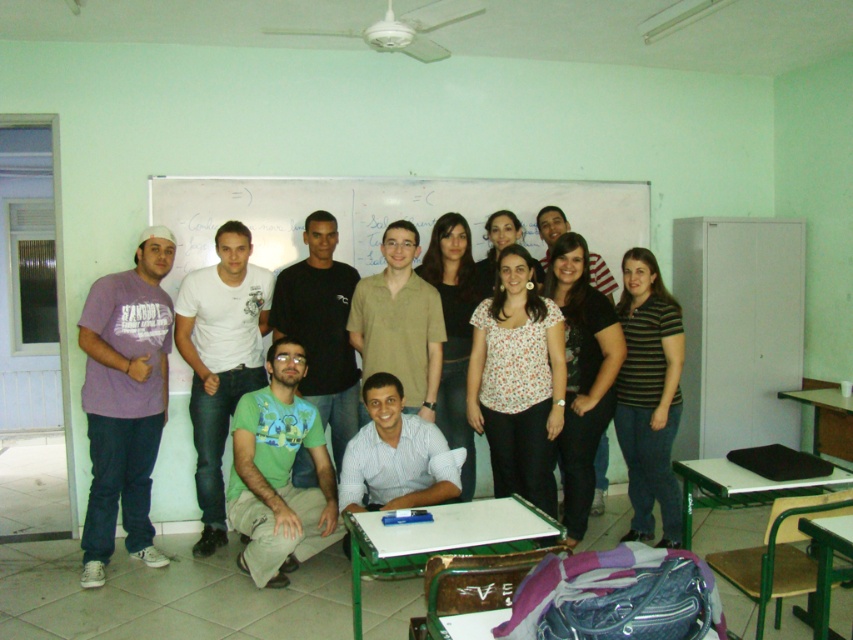
You are a photographer trying to adjust the composition of this group photo. You notice the striped cotton shirt at right and the white dotted shirt at center. Which of these two shirts is positioned lower in the image?

The striped cotton shirt at right is located below the white dotted shirt at center, so it is positioned lower in the image.

You are a photographer trying to adjust the framing of a group photo. You notice two shirts in the image, a striped cotton shirt at right and a white dotted shirt at center. Which shirt should you adjust to ensure both shirts are equally visible in the photo?

The striped cotton shirt at right is not as tall as white dotted shirt at center, so you should adjust the striped cotton shirt at right to make it taller so both shirts are equally visible.